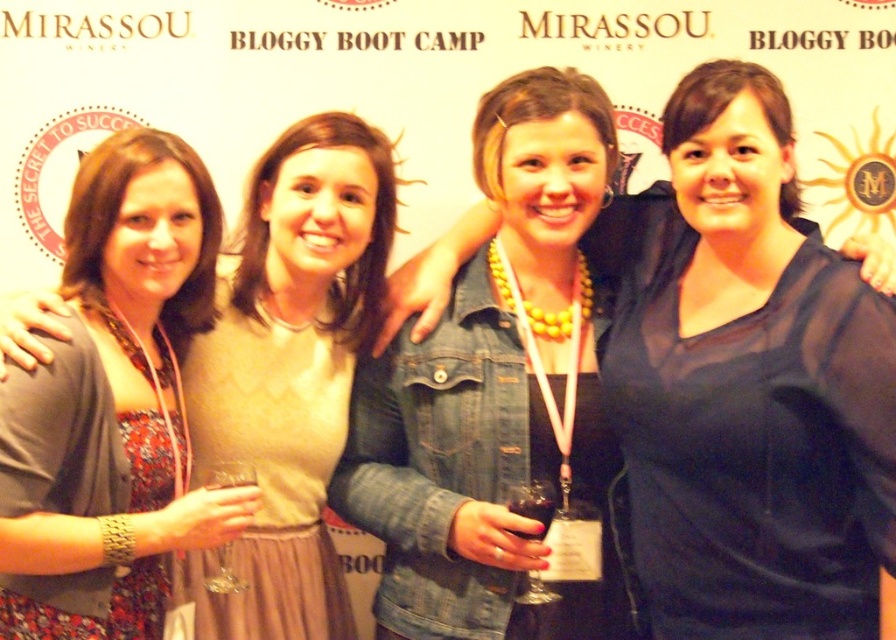
Question: Which point is closer to the camera?

Choices:
 (A) [x=268, y=429]
 (B) [x=694, y=499]

Answer: (B)

Question: Which point is closer to the camera?

Choices:
 (A) (293, 637)
 (B) (530, 516)
 (C) (813, 340)
 (D) (218, 557)

Answer: (D)

Question: Is clear glass wine glass at lower left wider than dark red glass at center?

Choices:
 (A) no
 (B) yes

Answer: (A)

Question: Is denim jacket at center positioned in front of translucent glass wine at center?

Choices:
 (A) no
 (B) yes

Answer: (A)

Question: Which object is the farthest from the translucent glass wine at center?

Choices:
 (A) clear glass wine glass at lower left
 (B) denim jacket at center
 (C) dark red glass at center

Answer: (A)

Question: Does translucent glass wine at center have a greater width compared to dark red glass at center?

Choices:
 (A) no
 (B) yes

Answer: (B)